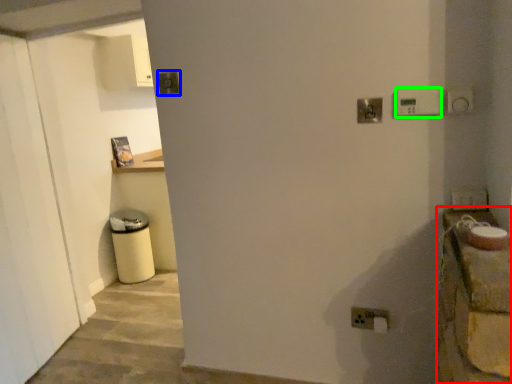
Question: Estimate the real-world distances between objects in this image. Which object is farther from counter top (highlighted by a red box), light switch (highlighted by a blue box) or light switch (highlighted by a green box)?

Choices:
 (A) light switch
 (B) light switch

Answer: (A)